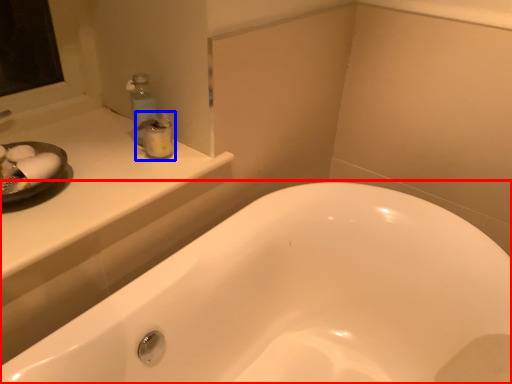
Question: Among these objects, which one is nearest to the camera, bathtub (highlighted by a red box) or toiletry (highlighted by a blue box)?

Choices:
 (A) bathtub
 (B) toiletry

Answer: (A)